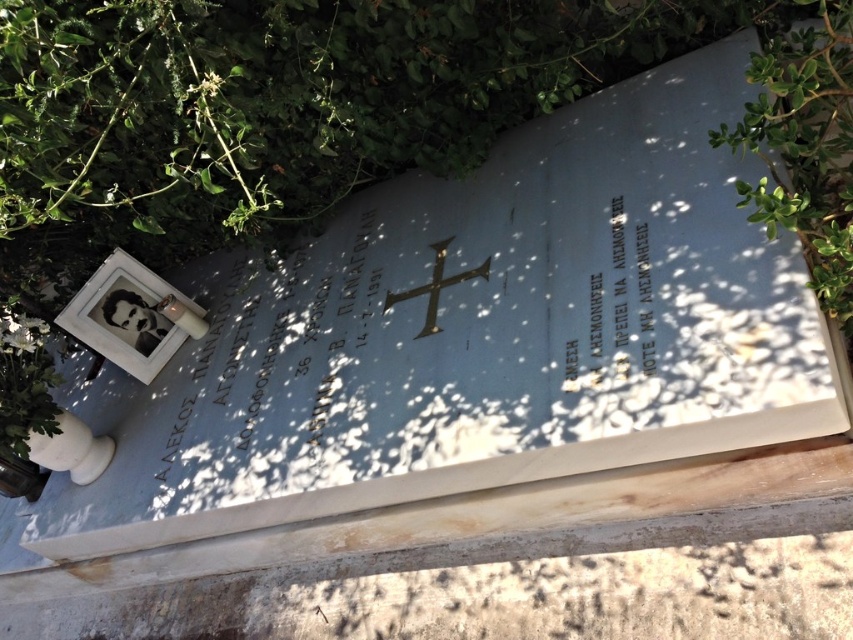
You are standing at the base of the tombstone and want to take a photo of the tombstone with the green leafy bush at upper right in the background. Your camera is 5.00 feet away from the bush. Can you position yourself so that the tombstone and the bush are both in frame?

The camera is 5.00 feet away from the green leafy bush at upper right. Since the camera is already positioned at that distance, you can adjust your angle to include both the tombstone and the bush in the frame as they are within the camera range.

You are standing in front of the tombstone and want to place a small flower at the base. The coordinates given represent points on the tombstone. Which point, point (721, 19) or point (444, 248), is closer to the ground where you can place the flower?

Point (721, 19) is closer to the camera than point (444, 248). Since the base of the tombstone is closer to the camera, placing the flower at point (721, 19) would be easier as it is nearer to the ground.